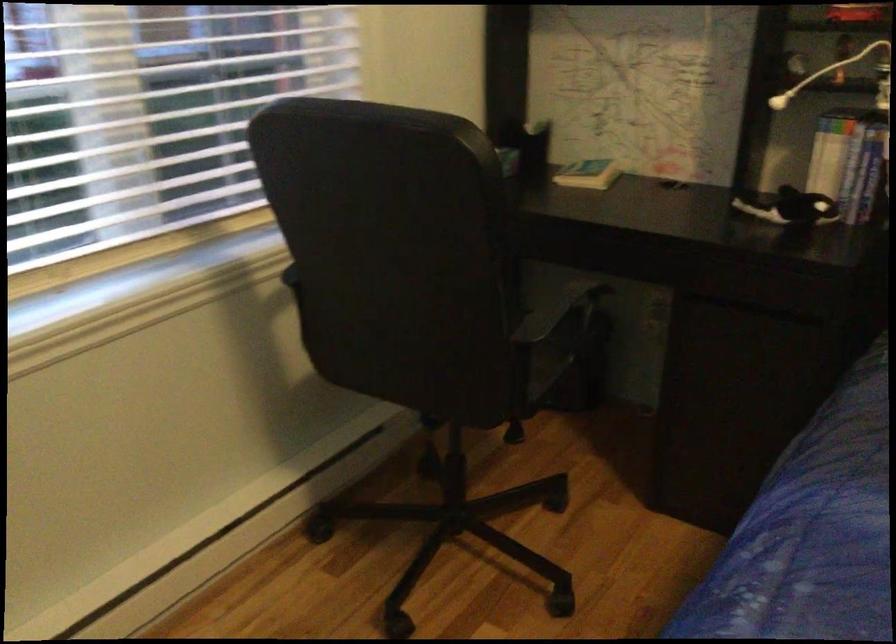
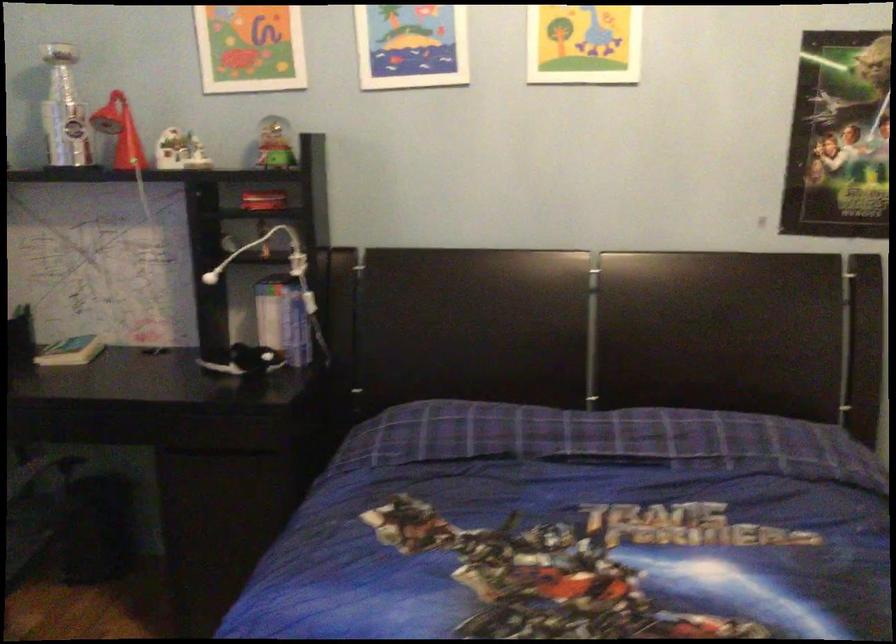
In the second image, find the point that corresponds to point (589, 173) in the first image.

(71, 351)